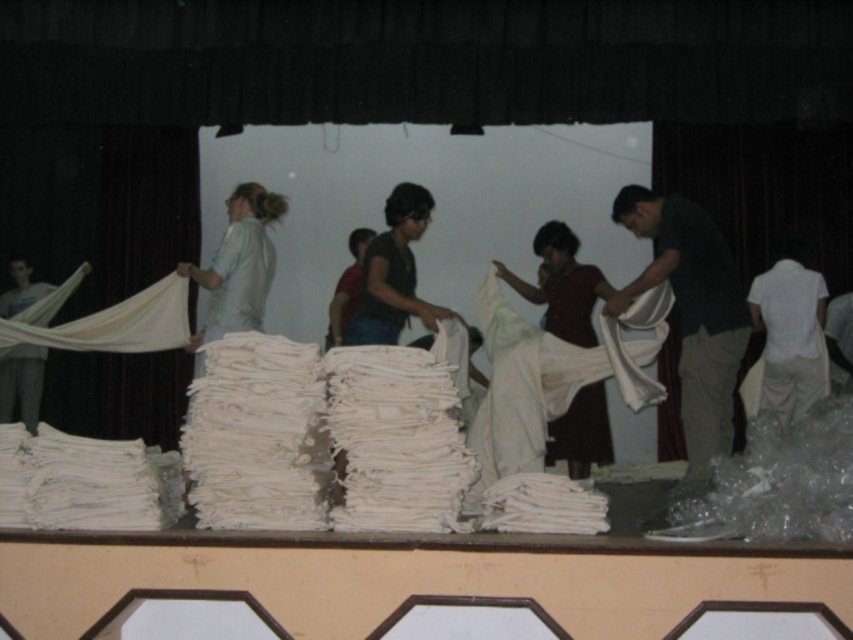
Does point (654, 273) come closer to viewer compared to point (779, 376)?

Yes, point (654, 273) is closer to viewer.

Between white fabric at right and white cotton shirt at right, which one appears on the left side from the viewer's perspective?

Positioned to the left is white fabric at right.

Is point (695, 481) closer to viewer compared to point (820, 340)?

Yes.

This screenshot has height=640, width=853. I want to click on white fabric at right, so click(691, 314).

Between white cotton shirt at right and matte gray pants at left, which one appears on the right side from the viewer's perspective?

white cotton shirt at right

Based on the photo, can you confirm if white cotton shirt at right is thinner than matte gray pants at left?

Incorrect, white cotton shirt at right's width is not less than matte gray pants at left's.

Between point (802, 284) and point (36, 374), which one is positioned behind?

The point (36, 374) is more distant.

Where is `white cotton shirt at right`? The width and height of the screenshot is (853, 640). white cotton shirt at right is located at coordinates (788, 337).

Who is shorter, matte white fabric at center or white cotton shirt at right?

white cotton shirt at right is shorter.

Identify the location of matte white fabric at center. The width and height of the screenshot is (853, 640). (561, 285).